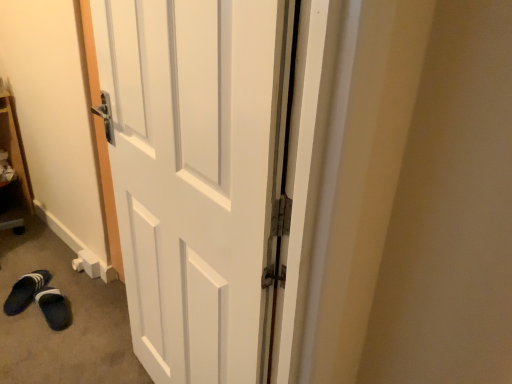
Question: Is black fabric slipper at lower left, placed as the 1th footwear when sorted from left to right, to the left of dark blue fabric slippers at lower left, the second footwear viewed from the left, from the viewer's perspective?

Choices:
 (A) yes
 (B) no

Answer: (A)

Question: From the image's perspective, does black fabric slipper at lower left, arranged as the 2th footwear when viewed from the right, appear lower than dark blue fabric slippers at lower left, the first footwear in the right-to-left sequence?

Choices:
 (A) yes
 (B) no

Answer: (B)

Question: Can you confirm if black fabric slipper at lower left, placed as the 1th footwear when sorted from left to right, is smaller than dark blue fabric slippers at lower left, the second footwear viewed from the left?

Choices:
 (A) no
 (B) yes

Answer: (A)

Question: From a real-world perspective, is black fabric slipper at lower left, placed as the 1th footwear when sorted from left to right, physically below dark blue fabric slippers at lower left, the first footwear in the right-to-left sequence?

Choices:
 (A) no
 (B) yes

Answer: (A)

Question: Is the depth of black fabric slipper at lower left, placed as the 1th footwear when sorted from left to right, less than that of dark blue fabric slippers at lower left, the first footwear in the right-to-left sequence?

Choices:
 (A) yes
 (B) no

Answer: (B)

Question: Relative to dark blue fabric slippers at lower left, the second footwear viewed from the left, is white matte door at center in front or behind?

Choices:
 (A) behind
 (B) front

Answer: (B)

Question: Does point [x=122, y=104] appear closer or farther from the camera than point [x=66, y=316]?

Choices:
 (A) farther
 (B) closer

Answer: (B)

Question: Looking at their shapes, would you say white matte door at center is wider or thinner than dark blue fabric slippers at lower left, the first footwear in the right-to-left sequence?

Choices:
 (A) wide
 (B) thin

Answer: (B)

Question: From a real-world perspective, relative to dark blue fabric slippers at lower left, the first footwear in the right-to-left sequence, is white matte door at center vertically above or below?

Choices:
 (A) above
 (B) below

Answer: (A)

Question: Considering the relative positions of dark blue fabric slippers at lower left, the second footwear viewed from the left, and white matte door at center in the image provided, is dark blue fabric slippers at lower left, the second footwear viewed from the left, to the left or to the right of white matte door at center?

Choices:
 (A) right
 (B) left

Answer: (B)

Question: Is dark blue fabric slippers at lower left, the first footwear in the right-to-left sequence, wider or thinner than white matte door at center?

Choices:
 (A) thin
 (B) wide

Answer: (B)

Question: Is dark blue fabric slippers at lower left, the second footwear viewed from the left, inside or outside of white matte door at center?

Choices:
 (A) outside
 (B) inside

Answer: (A)

Question: Is dark blue fabric slippers at lower left, the second footwear viewed from the left, in front of or behind white matte door at center in the image?

Choices:
 (A) behind
 (B) front

Answer: (A)

Question: From a real-world perspective, is black fabric slipper at lower left, placed as the 1th footwear when sorted from left to right, above or below white matte door at center?

Choices:
 (A) above
 (B) below

Answer: (B)

Question: Looking at their shapes, would you say black fabric slipper at lower left, arranged as the 2th footwear when viewed from the right, is wider or thinner than white matte door at center?

Choices:
 (A) wide
 (B) thin

Answer: (A)